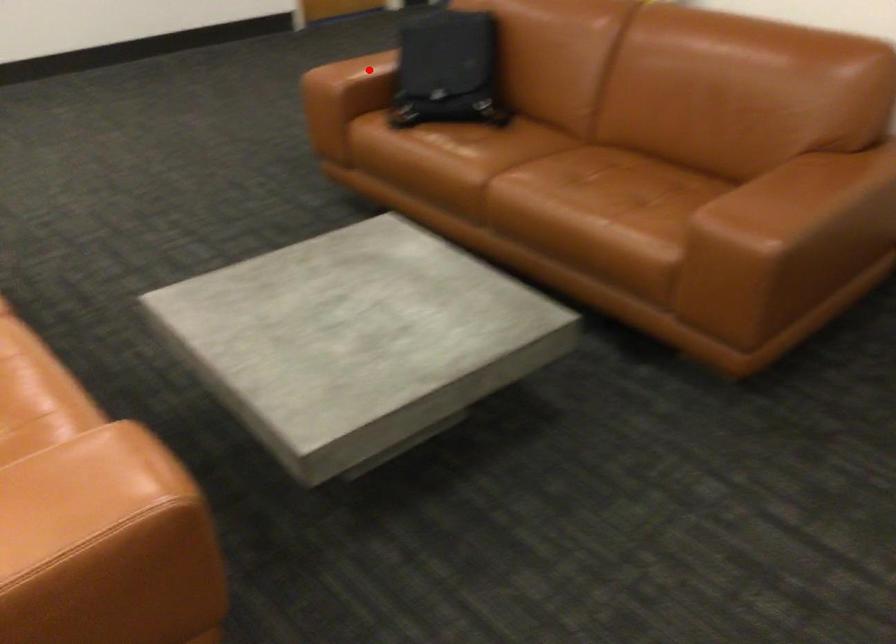
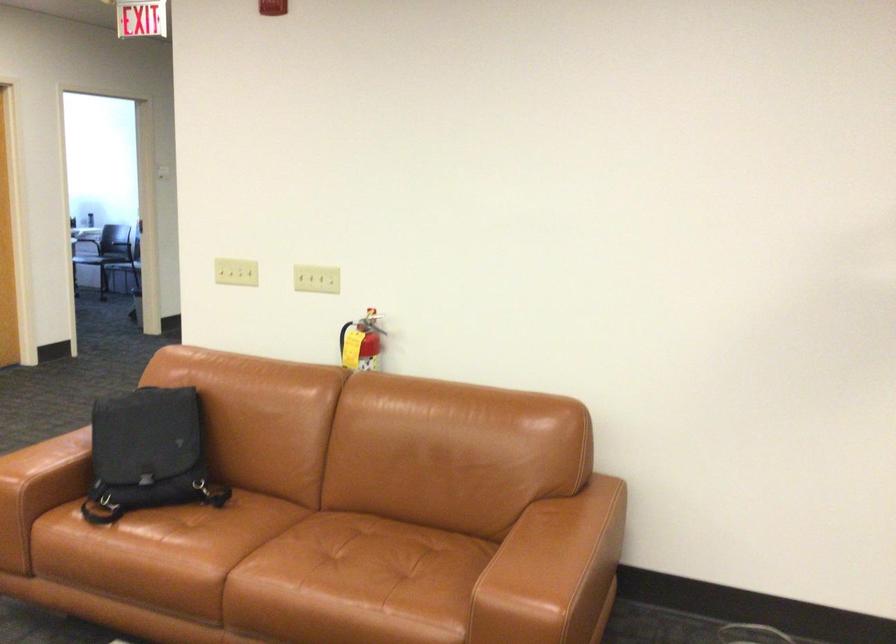
Locate, in the second image, the point that corresponds to the highlighted location in the first image.

(49, 467)